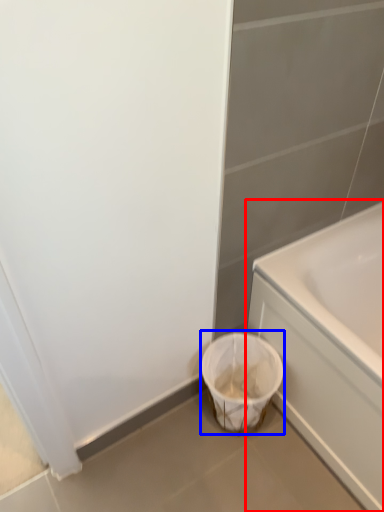
Question: Among these objects, which one is farthest to the camera, bathtub (highlighted by a red box) or laundry basket (highlighted by a blue box)?

Choices:
 (A) bathtub
 (B) laundry basket

Answer: (B)